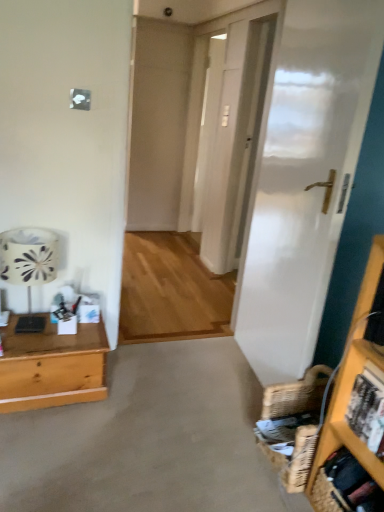
Where is `vacant region above beige carpet at lower center (from a real-world perspective)`? vacant region above beige carpet at lower center (from a real-world perspective) is located at coordinates (163, 410).